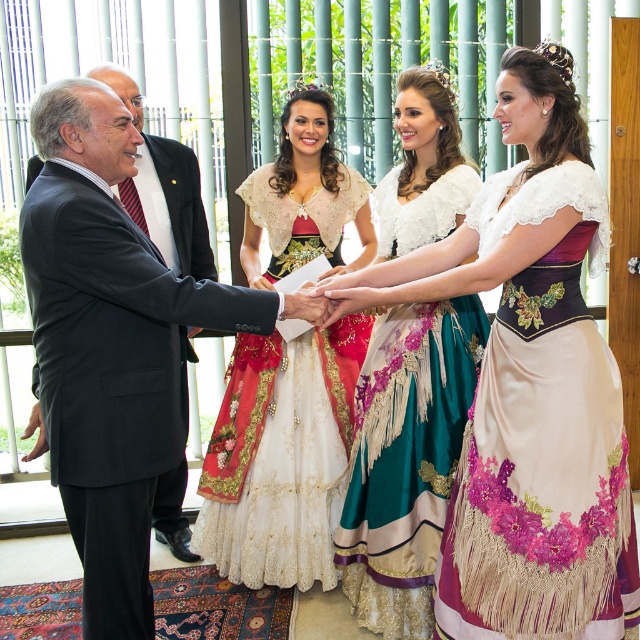
Between point (570, 454) and point (376, 352), which one is positioned in front?

Point (570, 454)

Who is shorter, purple satin dress at center or silk satin dress at center?

purple satin dress at center is shorter.

This screenshot has width=640, height=640. In order to click on purple satin dress at center in this screenshot , I will do coord(541,442).

I want to click on purple satin dress at center, so click(541, 442).

Is point (516, 392) farther from viewer compared to point (316, 419)?

No, (516, 392) is in front of (316, 419).

Between point (563, 589) and point (282, 490), which one is positioned behind?

The point (282, 490) is more distant.

Image resolution: width=640 pixels, height=640 pixels. I want to click on purple satin dress at center, so click(541, 442).

This screenshot has height=640, width=640. What do you see at coordinates (280, 456) in the screenshot?
I see `white lace dress at center` at bounding box center [280, 456].

Is point (269, 410) less distant than point (456, 224)?

No, (269, 410) is behind (456, 224).

In order to click on white lace dress at center in this screenshot , I will do `click(280, 456)`.